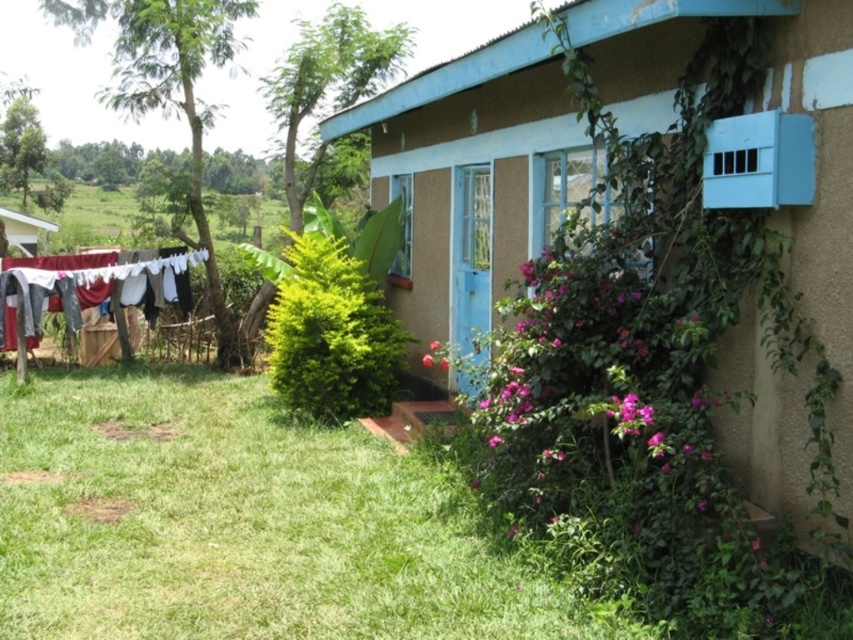
Question: Which object appears farthest from the camera in this image?

Choices:
 (A) green grass at lower left
 (B) white fabric at left

Answer: (B)

Question: Is matte brown house at center further to camera compared to white fabric at left?

Choices:
 (A) yes
 (B) no

Answer: (B)

Question: Which object is the closest to the green grass at lower left?

Choices:
 (A) white fabric at left
 (B) matte brown house at center

Answer: (B)

Question: Which object is closer to the camera taking this photo?

Choices:
 (A) green grass at lower left
 (B) white fabric at left
 (C) matte brown house at center

Answer: (C)

Question: In this image, where is green grass at lower left located relative to white fabric at left?

Choices:
 (A) above
 (B) below

Answer: (B)

Question: Is green grass at lower left in front of white fabric at left?

Choices:
 (A) yes
 (B) no

Answer: (A)